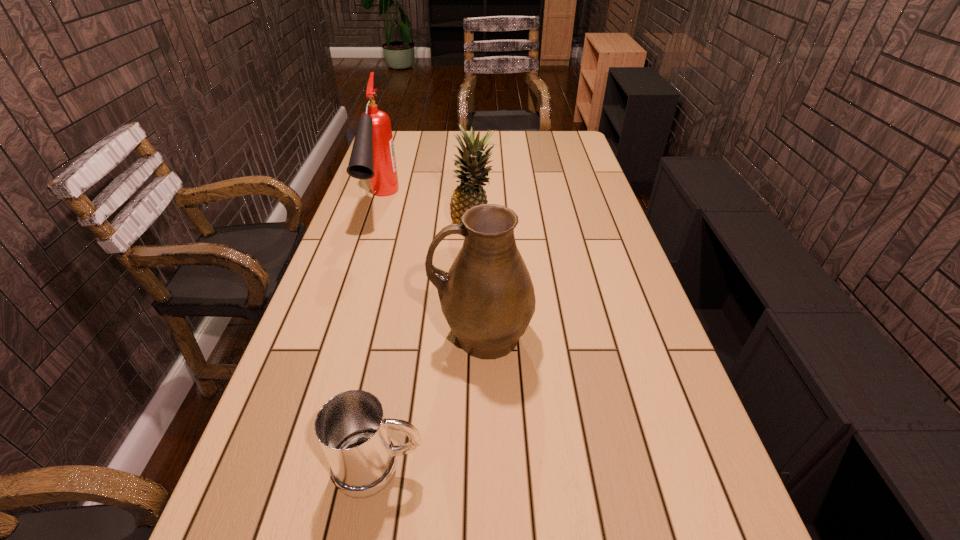
At what (x,y) coordinates should I click in order to perform the action: click on the leftmost object. Please return your answer as a coordinate pair (x, y). The image size is (960, 540). Looking at the image, I should click on (372, 157).

Locate an element on the screen. the third farthest object is located at coordinates (x=487, y=297).

Where is `pineapple`? This screenshot has height=540, width=960. pineapple is located at coordinates (470, 192).

Find the location of a particular element. The width and height of the screenshot is (960, 540). the nearest object is located at coordinates (351, 428).

You are a GUI agent. You are given a task and a screenshot of the screen. Output one action in this format:
    pyautogui.click(x=<x>, y=<y>)
    Task: Click on the shortest object
    The image size is (960, 540).
    Given the screenshot: What is the action you would take?
    pyautogui.click(x=351, y=428)

Where is `vacant space situated at the nozzle of the leftmost object`? This screenshot has width=960, height=540. vacant space situated at the nozzle of the leftmost object is located at coordinates (346, 311).

Where is `vacant region located on the handle side of the third farthest object`? Image resolution: width=960 pixels, height=540 pixels. vacant region located on the handle side of the third farthest object is located at coordinates (311, 335).

I want to click on blank space located 0.130m on the handle side of the third farthest object, so click(x=382, y=335).

Identify the location of free location located on the handle side of the third farthest object. This screenshot has height=540, width=960. (307, 335).

Locate an element on the screen. vacant space located 0.300m on the left of the pineapple is located at coordinates (361, 228).